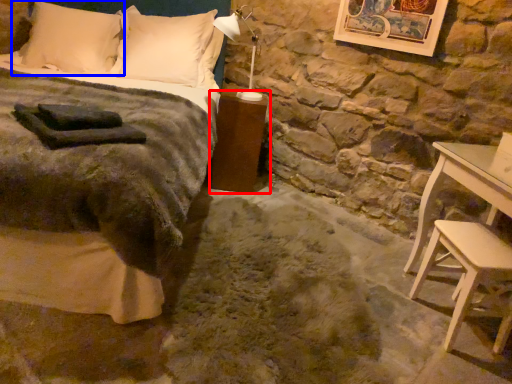
Question: Which point is further to the camera, nightstand (highlighted by a red box) or pillow (highlighted by a blue box)?

Choices:
 (A) nightstand
 (B) pillow

Answer: (B)